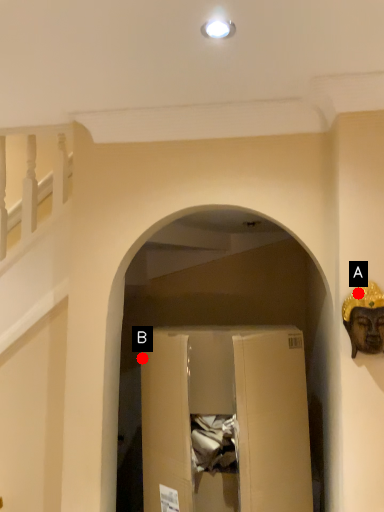
Question: Two points are circled on the image, labeled by A and B beside each circle. Which point is farther to the camera?

Choices:
 (A) A is further
 (B) B is further

Answer: (B)